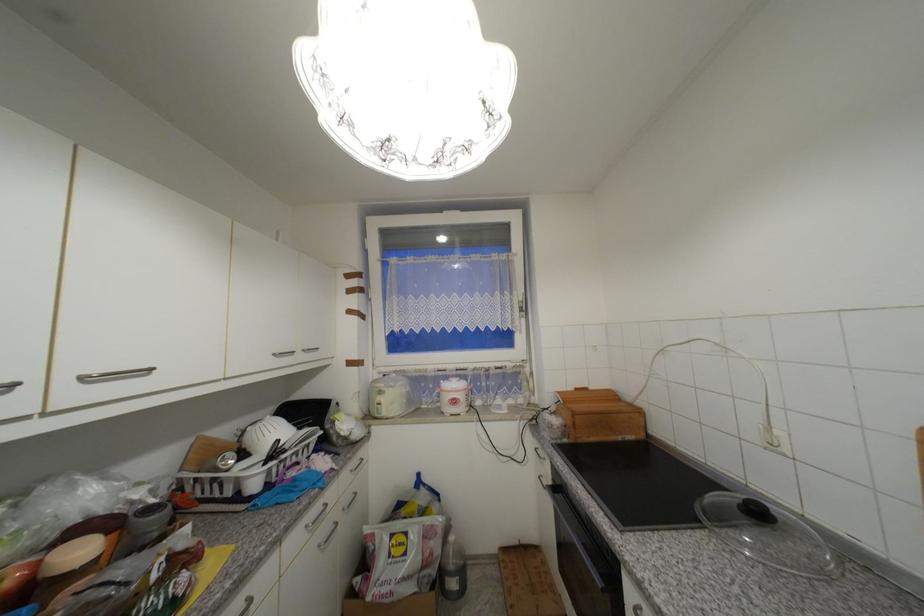
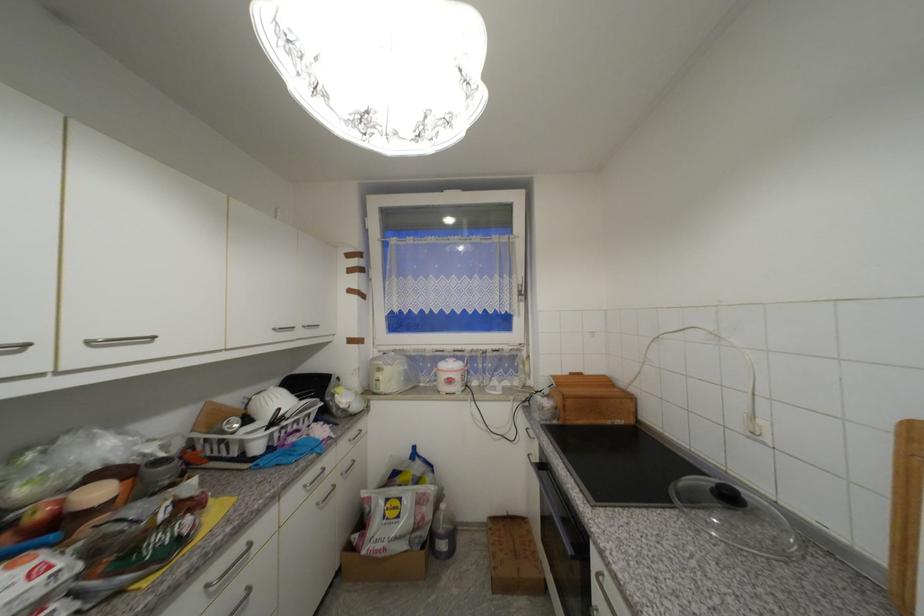
Locate, in the second image, the point that corresponds to point 281,355 in the first image.

(281, 331)